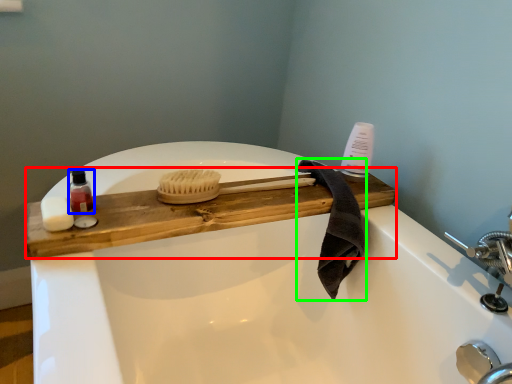
Question: Considering the real-world distances, which object is closest to counter top (highlighted by a red box)? toiletry (highlighted by a blue box) or bath towel (highlighted by a green box).

Choices:
 (A) toiletry
 (B) bath towel

Answer: (B)